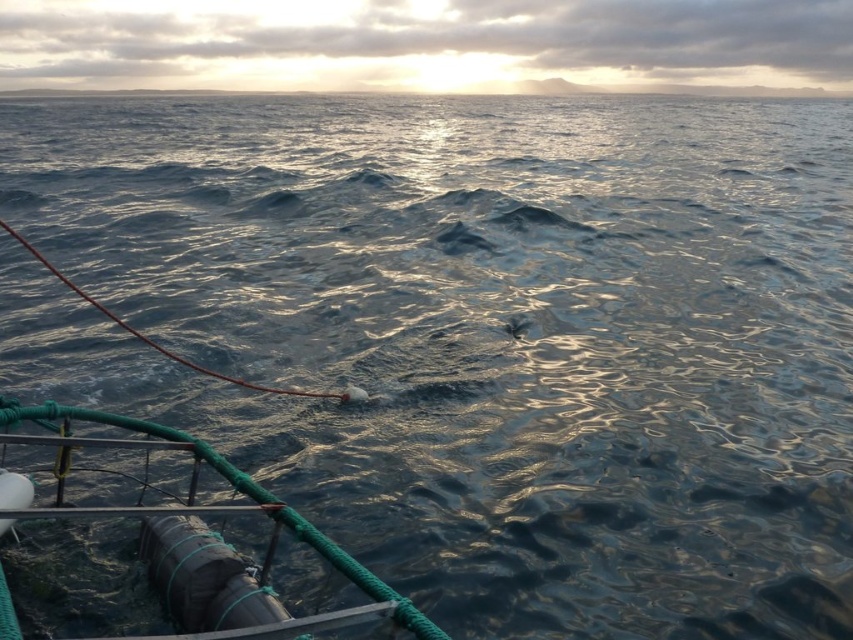
Question: Is rubberized black cylinder at lower left to the right of smooth sky at upper center from the viewer's perspective?

Choices:
 (A) no
 (B) yes

Answer: (A)

Question: Is rubberized black cylinder at lower left below smooth sky at upper center?

Choices:
 (A) no
 (B) yes

Answer: (B)

Question: Which point is farther to the camera?

Choices:
 (A) smooth sky at upper center
 (B) rubberized black cylinder at lower left

Answer: (A)

Question: Does rubberized black cylinder at lower left appear on the right side of smooth sky at upper center?

Choices:
 (A) yes
 (B) no

Answer: (B)